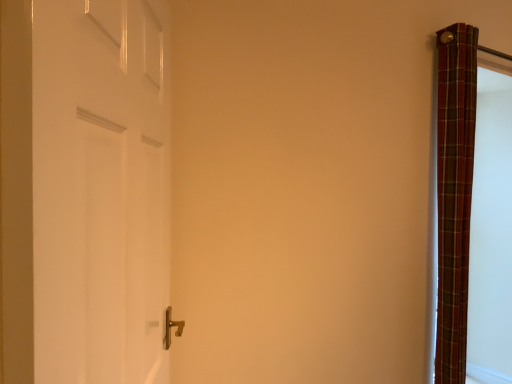
Question: In the image, is white glossy door at left positioned in front of or behind plaid fabric curtain at right?

Choices:
 (A) front
 (B) behind

Answer: (A)

Question: Considering the positions of white glossy door at left and plaid fabric curtain at right in the image, is white glossy door at left wider or thinner than plaid fabric curtain at right?

Choices:
 (A) wide
 (B) thin

Answer: (B)

Question: From their relative heights in the image, would you say white glossy door at left is taller or shorter than plaid fabric curtain at right?

Choices:
 (A) tall
 (B) short

Answer: (B)

Question: Looking at their shapes, would you say plaid fabric curtain at right is wider or thinner than white glossy door at left?

Choices:
 (A) thin
 (B) wide

Answer: (B)

Question: Is plaid fabric curtain at right inside or outside of white glossy door at left?

Choices:
 (A) inside
 (B) outside

Answer: (B)

Question: Is plaid fabric curtain at right to the left or to the right of white glossy door at left in the image?

Choices:
 (A) left
 (B) right

Answer: (B)

Question: From the image's perspective, is plaid fabric curtain at right located above or below white glossy door at left?

Choices:
 (A) below
 (B) above

Answer: (A)